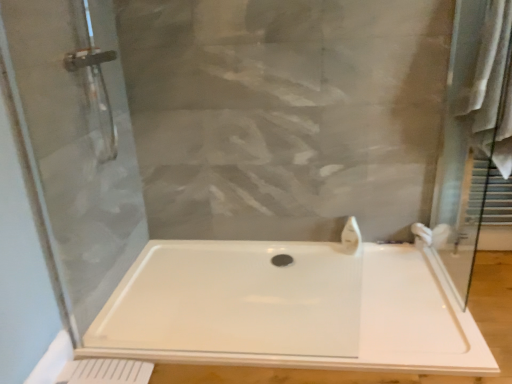
Question: Is white glossy faucet at upper right taller or shorter than white fabric bath towel at right?

Choices:
 (A) short
 (B) tall

Answer: (A)

Question: In terms of size, does white glossy faucet at upper right appear bigger or smaller than white fabric bath towel at right?

Choices:
 (A) big
 (B) small

Answer: (B)

Question: Based on their relative distances, which object is nearer to the white glossy faucet at upper right?

Choices:
 (A) white plastic bathtub at center
 (B) white fabric bath towel at right

Answer: (A)

Question: Which of these objects is positioned farthest from the white glossy faucet at upper right?

Choices:
 (A) white plastic bathtub at center
 (B) white fabric bath towel at right

Answer: (B)